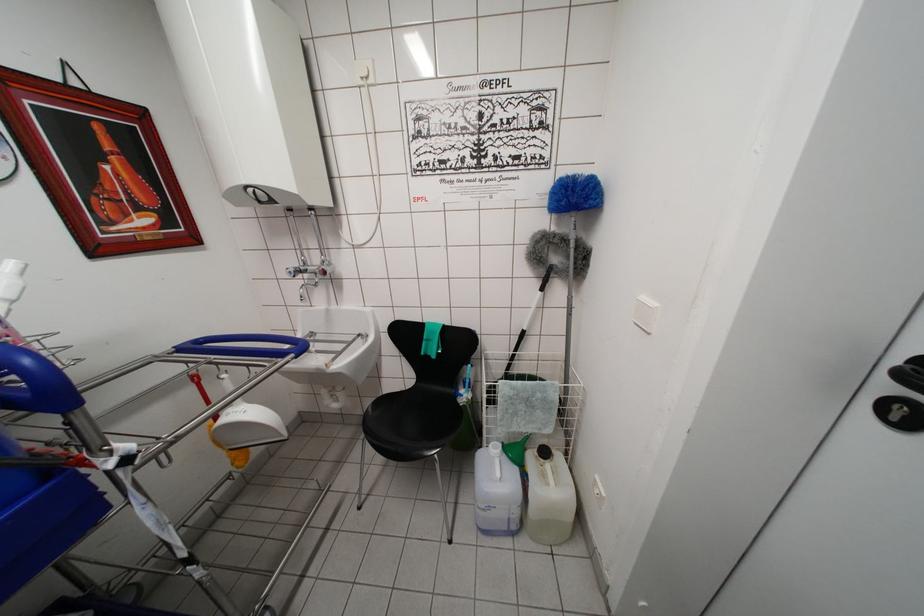
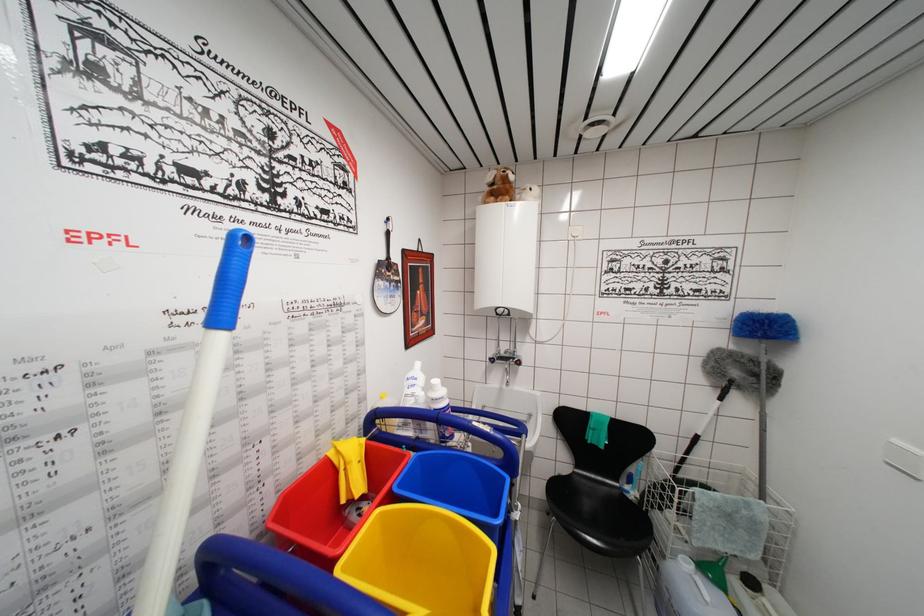
Which direction would the cameraman need to move to produce the second image?

The cameraman moved toward left, backward.